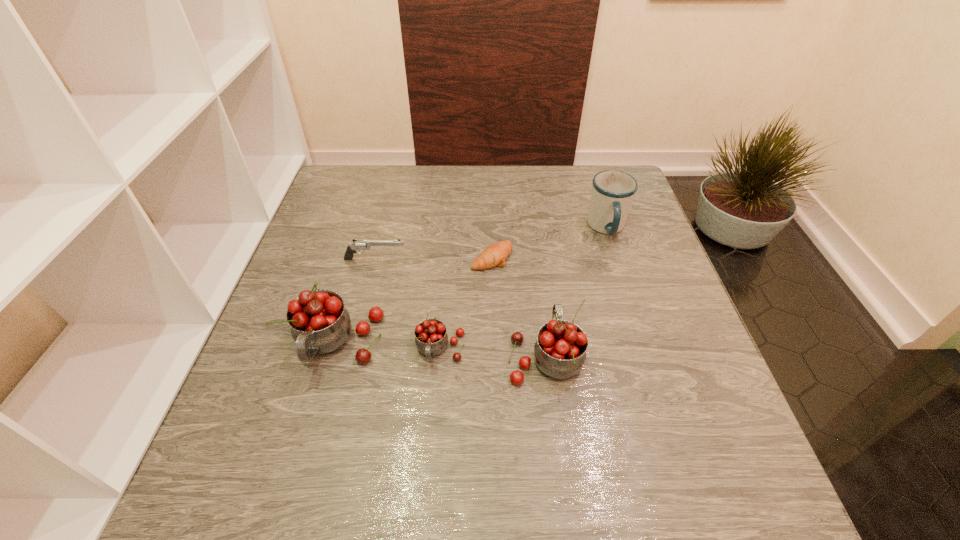
The cherrys are evenly distributed in the image. To maintain this, where would you place another cherry on the right? Please point to a free space. Please provide its 2D coordinates. Your answer should be formatted as a tuple, i.e. [(x, y)], where the tuple contains the x and y coordinates of a point satisfying the conditions above.

[(652, 362)]